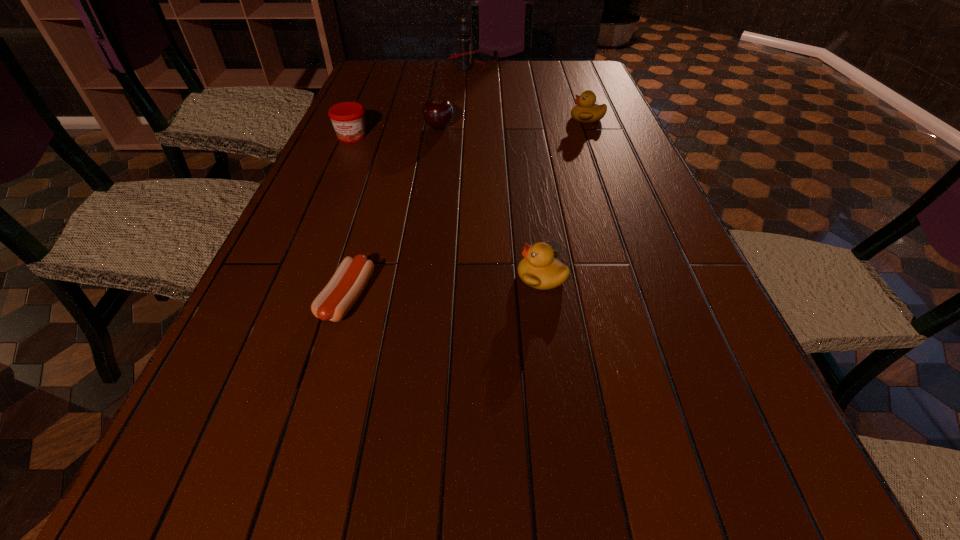
At what (x,y) coordinates should I click in order to perform the action: click on free space located 0.130m on the label of the root beer. Please return your answer as a coordinate pair (x, y). The height and width of the screenshot is (540, 960). Looking at the image, I should click on (518, 68).

At what (x,y) coordinates should I click in order to perform the action: click on vacant space situated 0.250m on the front of the apple. Please return your answer as a coordinate pair (x, y). This screenshot has height=540, width=960. Looking at the image, I should click on (432, 179).

Identify the location of free space located 0.090m on the front-facing side of the right duckling. (542, 118).

At what (x,y) coordinates should I click in order to perform the action: click on vacant space located 0.060m on the front-facing side of the right duckling. Please return your answer as a coordinate pair (x, y). Image resolution: width=960 pixels, height=540 pixels. Looking at the image, I should click on (552, 118).

This screenshot has height=540, width=960. What are the coordinates of `vacant region located on the front-facing side of the right duckling` in the screenshot? It's located at (483, 118).

Locate an element on the screen. vacant space positioned on the label side of the leftmost object is located at coordinates (342, 159).

The image size is (960, 540). Find the location of `free space located 0.390m on the front-facing side of the left duckling`. free space located 0.390m on the front-facing side of the left duckling is located at coordinates (327, 276).

Where is `vacant region located 0.210m on the front-facing side of the left duckling`? The width and height of the screenshot is (960, 540). vacant region located 0.210m on the front-facing side of the left duckling is located at coordinates (416, 276).

The image size is (960, 540). Identify the location of free location located 0.080m on the front-facing side of the left duckling. point(479,276).

Where is `vacant space positioned on the front of the fifth object from right to left`? This screenshot has height=540, width=960. vacant space positioned on the front of the fifth object from right to left is located at coordinates pyautogui.click(x=328, y=364).